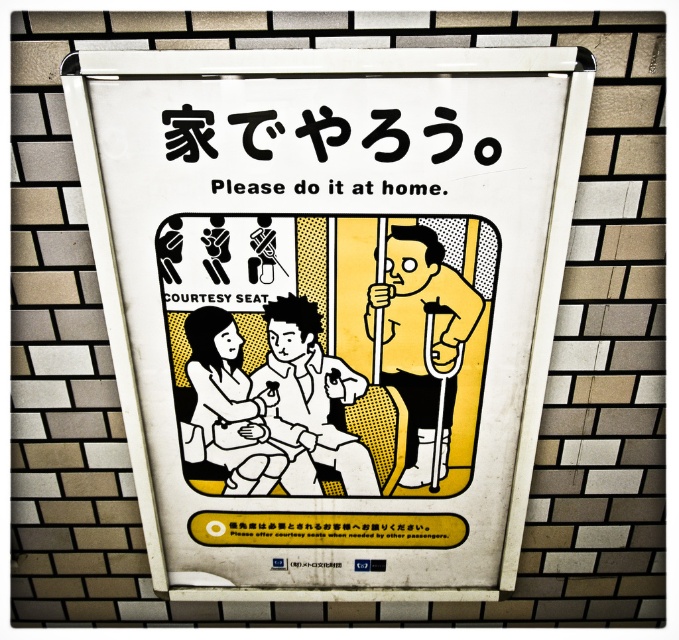
From the picture: Which is above, white paper sign at center or yellow matte crutches at center?

yellow matte crutches at center is above.

Who is more forward, [528,413] or [435,378]?

Point [435,378] is more forward.

Who is more distant from viewer, (483, 576) or (460, 328)?

The point (483, 576) is more distant.

This screenshot has height=640, width=679. Identify the location of white paper sign at center. (329, 304).

Does white paper sign at center come in front of white matte shirt at center?

Yes, it is.

Can you confirm if white paper sign at center is shorter than white matte shirt at center?

Incorrect, white paper sign at center's height does not fall short of white matte shirt at center's.

Is point (187, 372) behind point (371, 460)?

No, it is in front of (371, 460).

You are a GUI agent. You are given a task and a screenshot of the screen. Output one action in this format:
    pyautogui.click(x=<x>, y=<y>)
    Task: Click on the white paper sign at center
    This screenshot has width=679, height=640.
    Given the screenshot: What is the action you would take?
    pyautogui.click(x=329, y=304)

Is point (492, 468) positioned behind point (263, 481)?

No, it is in front of (263, 481).

Who is more distant from viewer, (361, 577) or (221, 349)?

The point (361, 577) is more distant.

Who is more distant from viewer, (227, 216) or (246, 392)?

The point (246, 392) is behind.

Where is `white paper sign at center`? The height and width of the screenshot is (640, 679). white paper sign at center is located at coordinates (329, 304).